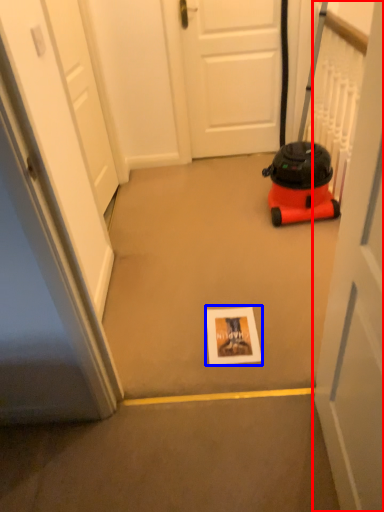
Question: Which point is closer to the camera, door (highlighted by a red box) or postcard (highlighted by a blue box)?

Choices:
 (A) door
 (B) postcard

Answer: (A)